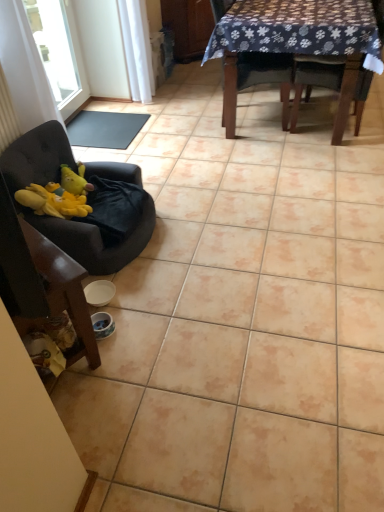
The width and height of the screenshot is (384, 512). Find the location of `unoccupied region to the right of velvet dark gray chair at left, arranged as the third chair when viewed from the right`. unoccupied region to the right of velvet dark gray chair at left, arranged as the third chair when viewed from the right is located at coordinates (214, 237).